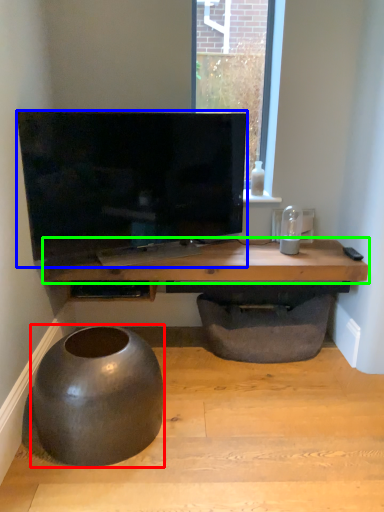
Question: Which object is positioned farthest from round table (highlighted by a red box)? Select from television (highlighted by a blue box) and table (highlighted by a green box).

Choices:
 (A) television
 (B) table

Answer: (A)